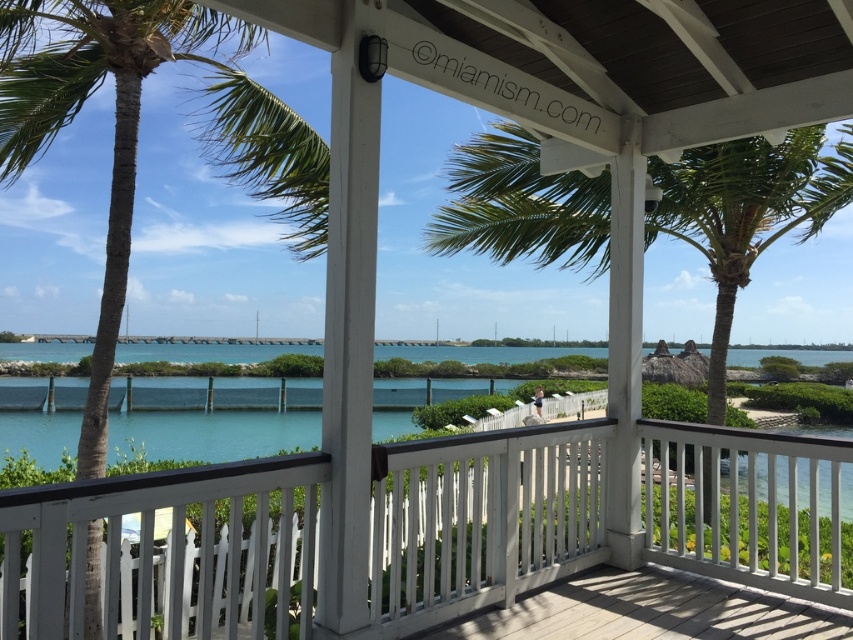
Question: Among these objects, which one is farthest from the camera?

Choices:
 (A) white wooden railing at center
 (B) green leafy palm tree at left

Answer: (B)

Question: Can you confirm if green leafy palm tree at left is smaller than green leafy palm tree at center?

Choices:
 (A) no
 (B) yes

Answer: (A)

Question: Which point is closer to the camera?

Choices:
 (A) green leafy palm tree at center
 (B) green leafy palm tree at left

Answer: (B)

Question: Is white wooden railing at center wider than green leafy palm tree at left?

Choices:
 (A) yes
 (B) no

Answer: (A)

Question: Which object appears closest to the camera in this image?

Choices:
 (A) white wooden railing at center
 (B) green leafy palm tree at left
 (C) green leafy palm tree at center

Answer: (A)

Question: Can you confirm if green leafy palm tree at left is positioned to the right of green leafy palm tree at center?

Choices:
 (A) yes
 (B) no

Answer: (B)